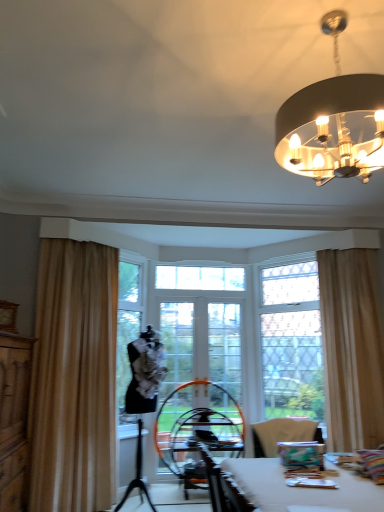
Identify the location of wooden dresser at left. (14, 419).

Find the location of a particular element. The height and width of the screenshot is (512, 384). matte black chandelier at upper right is located at coordinates (333, 122).

The width and height of the screenshot is (384, 512). Describe the element at coordinates (351, 349) in the screenshot. I see `beige fabric curtain at right, the first curtain when ordered from right to left` at that location.

Describe the element at coordinates (197, 430) in the screenshot. I see `black leather swivel chair at center` at that location.

The width and height of the screenshot is (384, 512). Describe the element at coordinates (301, 488) in the screenshot. I see `white glossy table at lower right` at that location.

Measure the distance between clear glass screen door at center and camera.

A distance of 4.71 meters exists between clear glass screen door at center and camera.

What are the coordinates of `wooden dresser at left` in the screenshot? It's located at (14, 419).

From the picture: Could you measure the distance between beige fabric curtain at right, arranged as the 2th curtain when viewed from the left, and beige fabric curtain at left, which is the 2th curtain from right to left?

beige fabric curtain at right, arranged as the 2th curtain when viewed from the left, and beige fabric curtain at left, which is the 2th curtain from right to left, are 7.50 feet apart from each other.

Does point (328, 360) appear closer or farther from the camera than point (66, 395)?

Point (328, 360).

From the image's perspective, is beige fabric curtain at right, the first curtain when ordered from right to left, over beige fabric curtain at left, the first curtain from the left?

A: Yes, from the image's perspective, beige fabric curtain at right, the first curtain when ordered from right to left, is over beige fabric curtain at left, the first curtain from the left.

Is beige fabric curtain at left, the first curtain from the left, a part of beige fabric curtain at right, the first curtain when ordered from right to left?

No, beige fabric curtain at left, the first curtain from the left, is not surrounded by beige fabric curtain at right, the first curtain when ordered from right to left.

Is point (303, 490) in front of point (17, 430)?

Yes, it is in front of point (17, 430).

Is white glossy table at lower right next to wooden dresser at left?

white glossy table at lower right and wooden dresser at left are clearly separated.

Considering the relative sizes of white glossy table at lower right and wooden dresser at left in the image provided, is white glossy table at lower right wider than wooden dresser at left?

Correct, the width of white glossy table at lower right exceeds that of wooden dresser at left.

Would you say white glossy table at lower right is to the left or to the right of wooden dresser at left in the picture?

From the image, it's evident that white glossy table at lower right is to the right of wooden dresser at left.

Which object is thinner, clear glass screen door at center or matte black chandelier at upper right?

With smaller width is clear glass screen door at center.

Choose the correct answer: Is clear glass screen door at center inside matte black chandelier at upper right or outside it?

The correct answer is: outside.

Is clear glass screen door at center touching matte black chandelier at upper right?

No, clear glass screen door at center is not with matte black chandelier at upper right.

From the image's perspective, is clear glass screen door at center on top of matte black chandelier at upper right?

No, from the image's perspective, clear glass screen door at center is not above matte black chandelier at upper right.

Is beige fabric curtain at right, arranged as the 2th curtain when viewed from the left, further to the viewer compared to matte black chandelier at upper right?

Yes, beige fabric curtain at right, arranged as the 2th curtain when viewed from the left, is further from the viewer.

Does beige fabric curtain at right, arranged as the 2th curtain when viewed from the left, turn towards matte black chandelier at upper right?

No, beige fabric curtain at right, arranged as the 2th curtain when viewed from the left, is not aimed at matte black chandelier at upper right.

From the image's perspective, does beige fabric curtain at right, arranged as the 2th curtain when viewed from the left, appear lower than matte black chandelier at upper right?

Indeed, from the image's perspective, beige fabric curtain at right, arranged as the 2th curtain when viewed from the left, is shown beneath matte black chandelier at upper right.

Between beige fabric curtain at right, the first curtain when ordered from right to left, and matte black chandelier at upper right, which one has smaller size?

With smaller size is matte black chandelier at upper right.

Is white glossy table at lower right oriented away from beige fabric curtain at right, arranged as the 2th curtain when viewed from the left?

white glossy table at lower right does not have its back to beige fabric curtain at right, arranged as the 2th curtain when viewed from the left.

Consider the image. Is white glossy table at lower right directly adjacent to beige fabric curtain at right, arranged as the 2th curtain when viewed from the left?

white glossy table at lower right and beige fabric curtain at right, arranged as the 2th curtain when viewed from the left, are not in contact.

Is point (252, 501) positioned after point (340, 273)?

No, it is not.

Which object is positioned more to the left, beige fabric curtain at left, the first curtain from the left, or clear glass screen door at center?

Positioned to the left is beige fabric curtain at left, the first curtain from the left.

Considering the sizes of objects beige fabric curtain at left, the first curtain from the left, and clear glass screen door at center in the image provided, who is wider, beige fabric curtain at left, the first curtain from the left, or clear glass screen door at center?

Wider between the two is beige fabric curtain at left, the first curtain from the left.

From a real-world perspective, is beige fabric curtain at left, which is the 2th curtain from right to left, physically located above or below clear glass screen door at center?

Clearly, from a real-world perspective, beige fabric curtain at left, which is the 2th curtain from right to left, is above clear glass screen door at center.

Is point (79, 471) behind point (190, 366)?

No, (79, 471) is in front of (190, 366).

Between beige fabric curtain at right, arranged as the 2th curtain when viewed from the left, and clear glass window at center, which one has smaller size?

beige fabric curtain at right, arranged as the 2th curtain when viewed from the left.

Is clear glass window at center at the back of beige fabric curtain at right, arranged as the 2th curtain when viewed from the left?

beige fabric curtain at right, arranged as the 2th curtain when viewed from the left, does not have its back to clear glass window at center.

Could clear glass window at center be considered to be inside beige fabric curtain at right, the first curtain when ordered from right to left?

No, clear glass window at center is not a part of beige fabric curtain at right, the first curtain when ordered from right to left.

Which is in front, point (356, 414) or point (301, 329)?

The point (356, 414) is in front.

Image resolution: width=384 pixels, height=512 pixels. In order to click on curtain below the beige fabric curtain at right, the first curtain when ordered from right to left (from a real-world perspective) in this screenshot , I will do `click(74, 378)`.

Locate an element on the screen. This screenshot has height=512, width=384. dresser on the left of white glossy table at lower right is located at coordinates (14, 419).

Considering their positions, is clear glass screen door at center positioned further to beige fabric curtain at left, the first curtain from the left, than white glossy table at lower right?

white glossy table at lower right is further to beige fabric curtain at left, the first curtain from the left.

Considering their positions, is clear glass screen door at center positioned closer to beige fabric curtain at right, the first curtain when ordered from right to left, than white fabric chair at center?

The object closer to beige fabric curtain at right, the first curtain when ordered from right to left, is clear glass screen door at center.

Estimate the real-world distances between objects in this image. Which object is further from black leather swivel chair at center, wooden dresser at left or clear glass screen door at center?

The object further to black leather swivel chair at center is wooden dresser at left.

From the image, which object appears to be nearer to black leather swivel chair at center, beige fabric curtain at left, the first curtain from the left, or beige fabric curtain at right, the first curtain when ordered from right to left?

beige fabric curtain at left, the first curtain from the left, is closer to black leather swivel chair at center.

Estimate the real-world distances between objects in this image. Which object is closer to clear glass window at center, black leather swivel chair at center or white fabric chair at center?

Based on the image, black leather swivel chair at center appears to be nearer to clear glass window at center.

Estimate the real-world distances between objects in this image. Which object is closer to black leather swivel chair at center, white glossy table at lower right or white fabric chair at center?

white fabric chair at center is positioned closer to the anchor black leather swivel chair at center.

Considering their positions, is white glossy table at lower right positioned further to matte black chandelier at upper right than wooden dresser at left?

wooden dresser at left lies further to matte black chandelier at upper right than the other object.

Which object lies further to the anchor point white glossy table at lower right, clear glass window at center or clear glass screen door at center?

The object further to white glossy table at lower right is clear glass screen door at center.

In order to click on swivel chair between white fabric chair at center and clear glass window at center in the front-back direction in this screenshot , I will do `click(197, 430)`.

This screenshot has height=512, width=384. I want to click on chair between wooden dresser at left and clear glass screen door at center from front to back, so click(282, 434).

Identify the location of dresser positioned between white glossy table at lower right and black leather swivel chair at center from near to far. Image resolution: width=384 pixels, height=512 pixels. (14, 419).

I want to click on chair between matte black chandelier at upper right and black leather swivel chair at center vertically, so click(282, 434).